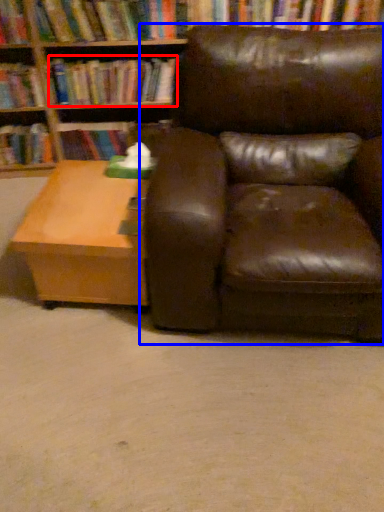
Question: Which object appears closest to the camera in this image, book (highlighted by a red box) or chair (highlighted by a blue box)?

Choices:
 (A) book
 (B) chair

Answer: (B)